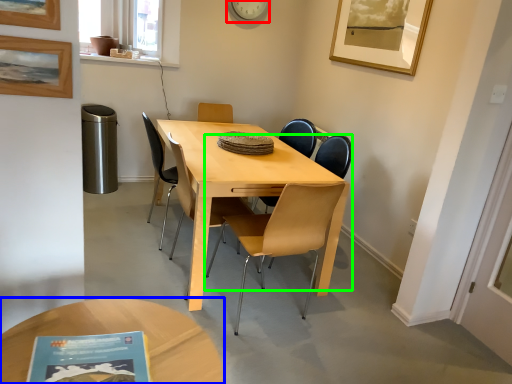
Question: Based on their relative distances, which object is farther from clock (highlighted by a red box)? Choose from coffee table (highlighted by a blue box) and chair (highlighted by a green box).

Choices:
 (A) coffee table
 (B) chair

Answer: (A)